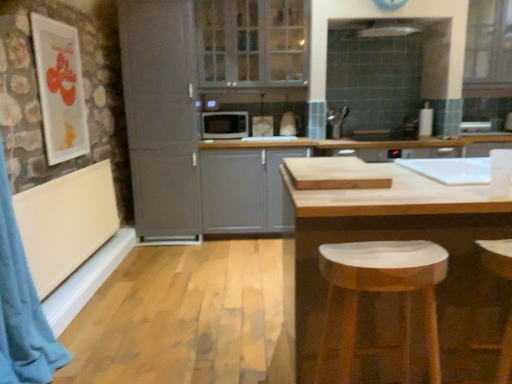
You are a GUI agent. You are given a task and a screenshot of the screen. Output one action in this format:
    pyautogui.click(x=<x>, y=<y>)
    Task: Click on the matte gray cabinet at center, positioned as the first cabinetry in right-to-left order
    The image size is (512, 384).
    Given the screenshot: What is the action you would take?
    pyautogui.click(x=246, y=190)

Image resolution: width=512 pixels, height=384 pixels. Describe the element at coordinates (246, 190) in the screenshot. I see `matte gray cabinet at center, the second cabinetry from the left` at that location.

In order to click on natural wood table at center in this screenshot , I will do `click(391, 239)`.

In order to click on white marble stool at lower right in this screenshot , I will do `click(382, 292)`.

The height and width of the screenshot is (384, 512). What are the coordinates of `matte gray cabinet at center, the second cabinetry from the left` in the screenshot? It's located at (246, 190).

What's the angular difference between white marble stool at lower right and natural wood table at center's facing directions?

179 degrees.

Is white marble stool at lower right oriented away from natural wood table at center?

No, white marble stool at lower right is not facing the opposite direction of natural wood table at center.

Is white marble stool at lower right completely or partially outside of natural wood table at center?

Yes.

Can you confirm if white marble stool at lower right is wider than natural wood table at center?

Incorrect, the width of white marble stool at lower right does not surpass that of natural wood table at center.

Which object is wider, matte white picture frame at upper left or clear glass window at upper right, marked as the first window in a right-to-left arrangement?

With larger width is clear glass window at upper right, marked as the first window in a right-to-left arrangement.

Can you confirm if matte white picture frame at upper left is smaller than clear glass window at upper right, which is the 2th window from left to right?

Yes.

Is matte white picture frame at upper left at the right side of clear glass window at upper right, which is the 2th window from left to right?

No, matte white picture frame at upper left is not to the right of clear glass window at upper right, which is the 2th window from left to right.

Considering the positions of objects matte gray cabinet at center, positioned as the first cabinetry in right-to-left order, and matte white picture frame at upper left in the image provided, who is more to the right, matte gray cabinet at center, positioned as the first cabinetry in right-to-left order, or matte white picture frame at upper left?

matte gray cabinet at center, positioned as the first cabinetry in right-to-left order.

From the image's perspective, is matte gray cabinet at center, positioned as the first cabinetry in right-to-left order, below matte white picture frame at upper left?

Yes, from the image's perspective, matte gray cabinet at center, positioned as the first cabinetry in right-to-left order, is beneath matte white picture frame at upper left.

What's the angular difference between matte gray cabinet at center, positioned as the first cabinetry in right-to-left order, and matte white picture frame at upper left's facing directions?

88 degrees.

Can you see matte gray cabinet at center, the second cabinetry from the left, touching matte white picture frame at upper left?

They are not placed beside each other.

Is point (240, 131) more distant than point (435, 316)?

Yes.

Is the depth of matte gray microwave at center greater than that of white marble stool at lower right?

Yes, matte gray microwave at center is further from the camera.

Does matte gray microwave at center have a lesser height compared to white marble stool at lower right?

Yes.

How distant is matte gray microwave at center from white marble stool at lower right?

matte gray microwave at center and white marble stool at lower right are 2.88 meters apart from each other.

Is matte gray cabinet at left, which ranks as the 2th cabinetry in right-to-left order, facing away from matte white picture frame at upper left?

No, matte white picture frame at upper left is not at the back of matte gray cabinet at left, which ranks as the 2th cabinetry in right-to-left order.

Is point (141, 111) positioned behind point (42, 41)?

Yes, point (141, 111) is behind point (42, 41).

Is matte gray cabinet at left, the first cabinetry in the left-to-right sequence, shorter than matte white picture frame at upper left?

No, matte gray cabinet at left, the first cabinetry in the left-to-right sequence, is not shorter than matte white picture frame at upper left.

Which object is wider, matte gray cabinet at left, which ranks as the 2th cabinetry in right-to-left order, or matte white picture frame at upper left?

matte gray cabinet at left, which ranks as the 2th cabinetry in right-to-left order.

Is matte white picture frame at upper left inside the boundaries of matte gray microwave at center, or outside?

matte white picture frame at upper left exists outside the volume of matte gray microwave at center.

Which object is further away from the camera taking this photo, matte white picture frame at upper left or matte gray microwave at center?

matte gray microwave at center is further away from the camera.

Is matte white picture frame at upper left at the right side of matte gray microwave at center?

No, matte white picture frame at upper left is not to the right of matte gray microwave at center.

How different are the orientations of matte white picture frame at upper left and matte gray microwave at center in degrees?

There is a 87.3-degree angle between the facing directions of matte white picture frame at upper left and matte gray microwave at center.

From the image's perspective, is matte gray cabinet at left, which ranks as the 2th cabinetry in right-to-left order, located above clear glass window at upper right, marked as the first window in a right-to-left arrangement?

No, from the image's perspective, matte gray cabinet at left, which ranks as the 2th cabinetry in right-to-left order, is not over clear glass window at upper right, marked as the first window in a right-to-left arrangement.

From a real-world perspective, which object rests below the other?

matte gray cabinet at left, which ranks as the 2th cabinetry in right-to-left order, from a real-world perspective.

Which is in front, matte gray cabinet at left, which ranks as the 2th cabinetry in right-to-left order, or clear glass window at upper right, marked as the first window in a right-to-left arrangement?

matte gray cabinet at left, which ranks as the 2th cabinetry in right-to-left order, is more forward.

This screenshot has width=512, height=384. I want to click on window that is the 2nd one when counting rightward from the matte gray cabinet at left, which ranks as the 2th cabinetry in right-to-left order, so click(x=489, y=42).

Where is `stool lying on the left of natural wood table at center`? This screenshot has width=512, height=384. stool lying on the left of natural wood table at center is located at coordinates (382, 292).

Identify the location of picture frame in front of the clear glass window at upper right, marked as the first window in a right-to-left arrangement. (60, 89).

Looking at the image, which one is located closer to white marble stool at lower right, clear glass cabinet at upper center, the 2th window positioned from the right, or matte gray cabinet at left, the first cabinetry in the left-to-right sequence?

Based on the image, matte gray cabinet at left, the first cabinetry in the left-to-right sequence, appears to be nearer to white marble stool at lower right.

Which object lies further to the anchor point clear glass cabinet at upper center, the 2th window positioned from the right, matte white picture frame at upper left or white marble stool at lower right?

white marble stool at lower right.

Consider the image. Which object lies nearer to the anchor point white marble stool at lower right, blue fabric curtain at left or natural wood table at center?

natural wood table at center lies closer to white marble stool at lower right than the other object.

When comparing their distances from natural wood table at center, does matte gray cabinet at center, positioned as the first cabinetry in right-to-left order, or matte gray cabinet at left, which ranks as the 2th cabinetry in right-to-left order, seem further?

matte gray cabinet at left, which ranks as the 2th cabinetry in right-to-left order, is further to natural wood table at center.

Considering their positions, is natural wood table at center positioned further to white marble stool at lower right than matte gray microwave at center?

matte gray microwave at center lies further to white marble stool at lower right than the other object.

From the image, which object appears to be nearer to clear glass window at upper right, marked as the first window in a right-to-left arrangement, matte gray microwave at center or matte gray cabinet at left, the first cabinetry in the left-to-right sequence?

matte gray microwave at center is positioned closer to the anchor clear glass window at upper right, marked as the first window in a right-to-left arrangement.

Based on their spatial positions, is matte gray cabinet at left, which ranks as the 2th cabinetry in right-to-left order, or matte gray microwave at center further from blue fabric curtain at left?

Among the two, matte gray microwave at center is located further to blue fabric curtain at left.

Estimate the real-world distances between objects in this image. Which object is further from clear glass cabinet at upper center, which ranks as the 1th window in left-to-right order, clear glass window at upper right, which is the 2th window from left to right, or matte gray microwave at center?

The object further to clear glass cabinet at upper center, which ranks as the 1th window in left-to-right order, is clear glass window at upper right, which is the 2th window from left to right.

I want to click on window positioned between natural wood table at center and clear glass window at upper right, which is the 2th window from left to right, from near to far, so tap(253, 42).

Locate an element on the screen. Image resolution: width=512 pixels, height=384 pixels. table between matte white picture frame at upper left and clear glass window at upper right, which is the 2th window from left to right, from left to right is located at coordinates (391, 239).

You are a GUI agent. You are given a task and a screenshot of the screen. Output one action in this format:
    pyautogui.click(x=<x>, y=<y>)
    Task: Click on the curtain between white marble stool at lower right and clear glass cabinet at upper center, the 2th window positioned from the right, in the front-back direction
    
    Given the screenshot: What is the action you would take?
    pyautogui.click(x=22, y=306)

Find the location of a particular element. appliance located between matte white picture frame at upper left and clear glass window at upper right, marked as the first window in a right-to-left arrangement, in the left-right direction is located at coordinates (225, 125).